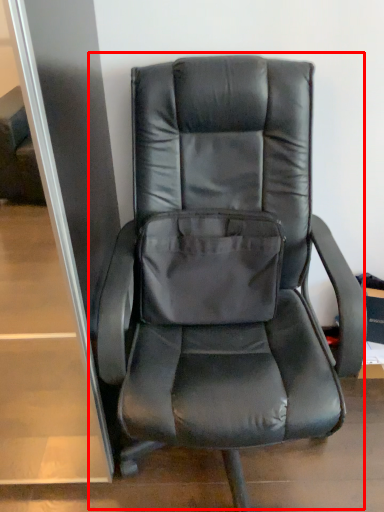
Question: Where is chair (annotated by the red box) located in relation to pocket in the image?

Choices:
 (A) left
 (B) right

Answer: (B)